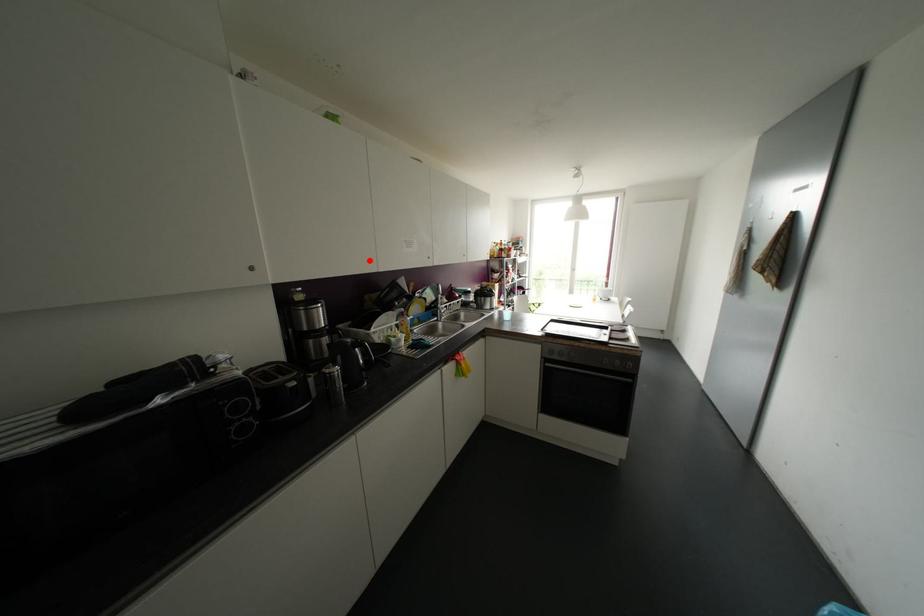
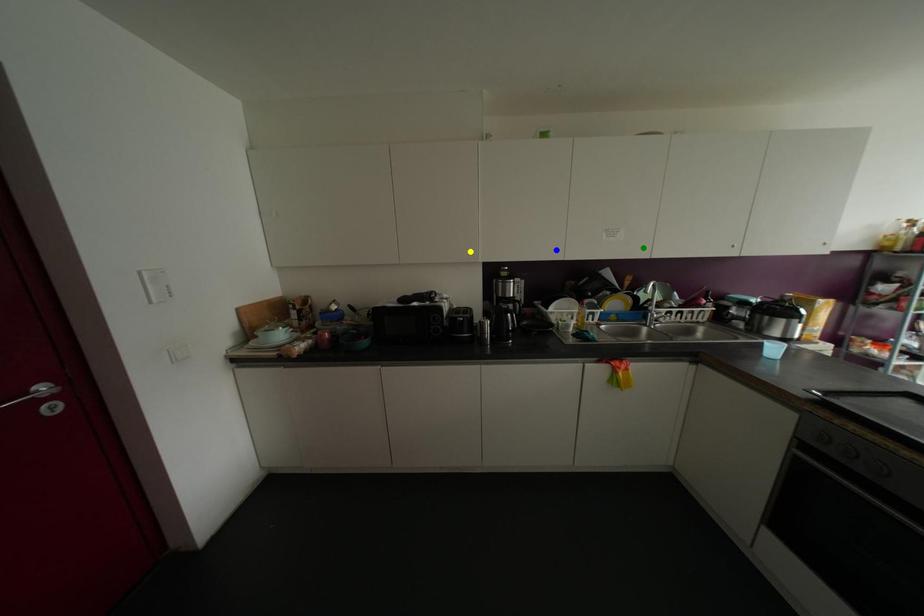
Question: I am providing you with two images of the same scene from different viewpoints. A red point is marked on the first image. You are given multiple points on the second image. In image 2, which mark is for the same physical point as the one in image 1?

Choices:
 (A) green point
 (B) blue point
 (C) yellow point

Answer: (B)